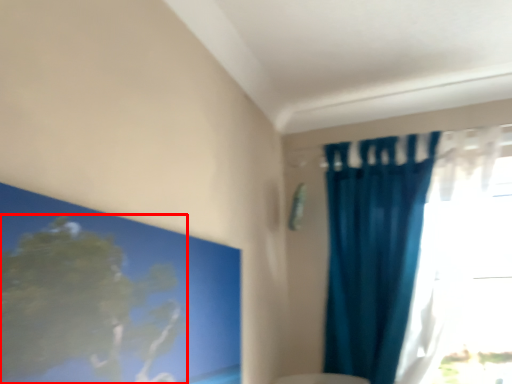
Question: Where is tree (annotated by the red box) located in relation to curtain in the image?

Choices:
 (A) left
 (B) right

Answer: (A)